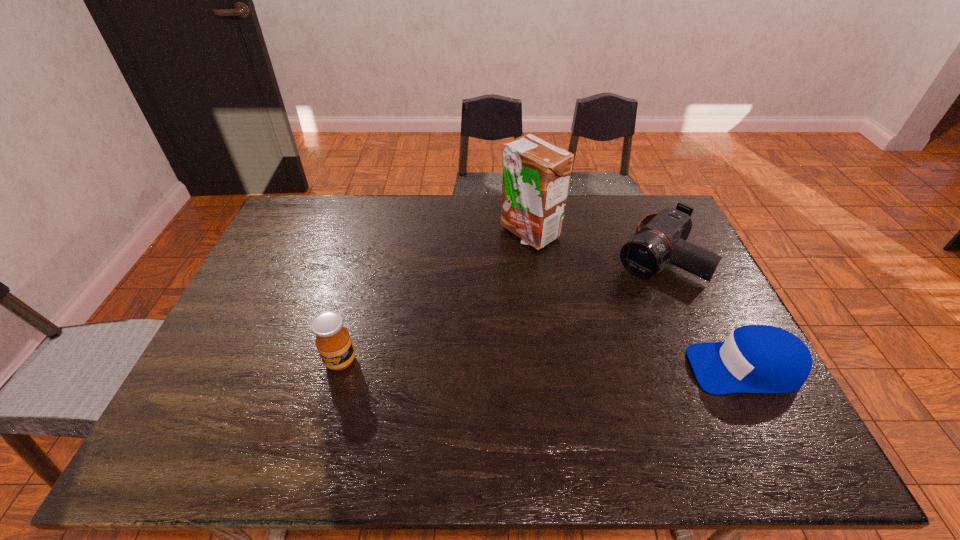
At what (x,y) coordinates should I click in order to perform the action: click on vacant spot on the desktop that is between the leftmost object and the baseball cap and is positioned on the straw side of the carton. Please return your answer as a coordinate pair (x, y). This screenshot has width=960, height=540. Looking at the image, I should click on (518, 364).

This screenshot has height=540, width=960. Find the location of `free space on the desktop that is between the second tallest object and the baseball cap and is positioned on the lens of the camcorder`. free space on the desktop that is between the second tallest object and the baseball cap and is positioned on the lens of the camcorder is located at coordinates (542, 364).